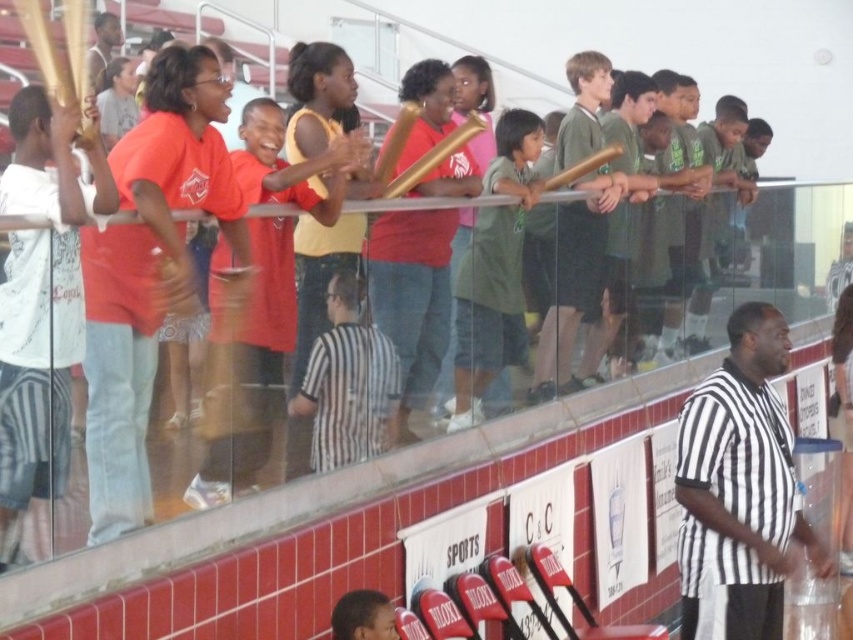
How far apart are black and white striped shirt at center and green matte shirt at center?

black and white striped shirt at center and green matte shirt at center are 1.54 meters apart from each other.

Is black and white striped shirt at center to the left of green matte shirt at center from the viewer's perspective?

No, black and white striped shirt at center is not to the left of green matte shirt at center.

Which is behind, point (753, 532) or point (468, 301)?

The point (468, 301) is more distant.

Find the location of a particular element. black and white striped shirt at center is located at coordinates (740, 490).

Who is higher up, black and white striped shirt at center or matte red shirt at center?

Positioned higher is matte red shirt at center.

Which is in front, point (753, 637) or point (283, 300)?

Point (283, 300) is in front.

At what (x,y) coordinates should I click in order to perform the action: click on black and white striped shirt at center. Please return your answer as a coordinate pair (x, y). The image size is (853, 640). Looking at the image, I should click on (x=740, y=490).

Can you confirm if matte red shirt at center is thinner than green matte shirt at center?

No, matte red shirt at center is not thinner than green matte shirt at center.

Who is higher up, matte red shirt at center or green matte shirt at center?

green matte shirt at center is above.

Between point (242, 364) and point (467, 417), which one is positioned in front?

Positioned in front is point (242, 364).

Identify the location of matte red shirt at center. (254, 369).